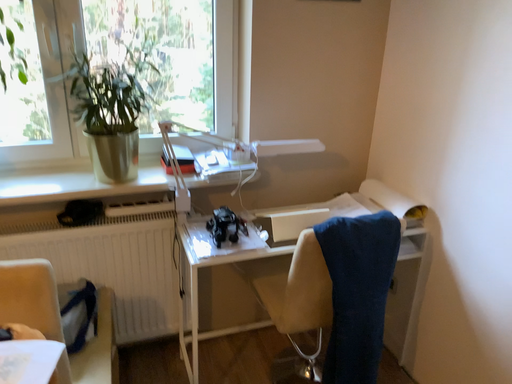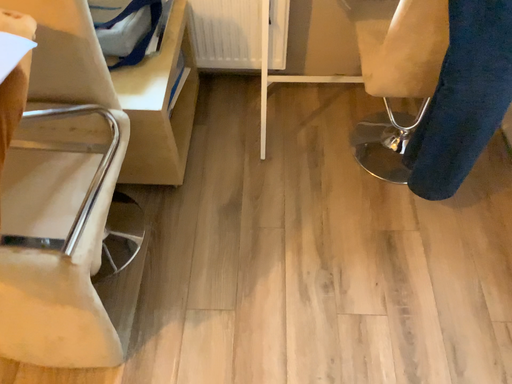
Question: How did the camera likely rotate when shooting the video?

Choices:
 (A) rotated left
 (B) rotated right

Answer: (A)